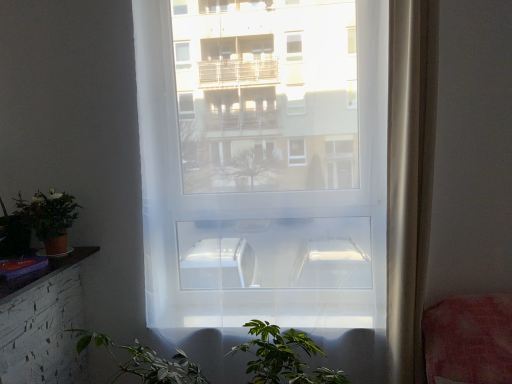
Question: Is transparent plastic window at center inside or outside of sheer white curtain at right?

Choices:
 (A) inside
 (B) outside

Answer: (B)

Question: In terms of width, does transparent plastic window at center look wider or thinner when compared to sheer white curtain at right?

Choices:
 (A) wide
 (B) thin

Answer: (B)

Question: Which object is the farthest from the sheer white curtain at right?

Choices:
 (A) transparent plastic window at center
 (B) matte terracotta pot at lower left

Answer: (B)

Question: Considering the real-world distances, which object is closest to the sheer white curtain at right?

Choices:
 (A) transparent plastic window at center
 (B) matte terracotta pot at lower left

Answer: (A)